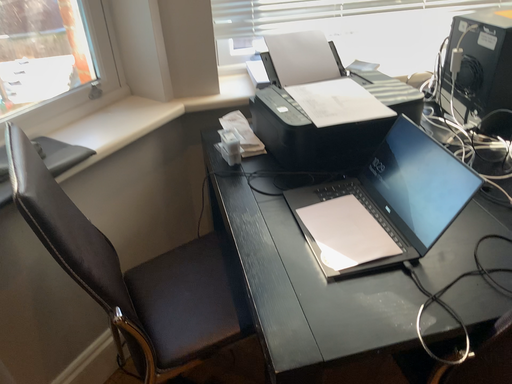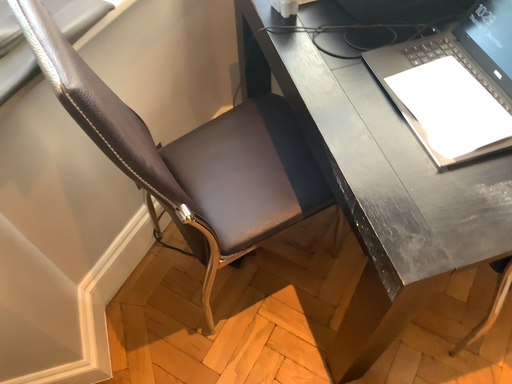
Question: How did the camera likely rotate when shooting the video?

Choices:
 (A) rotated upward
 (B) rotated downward

Answer: (B)